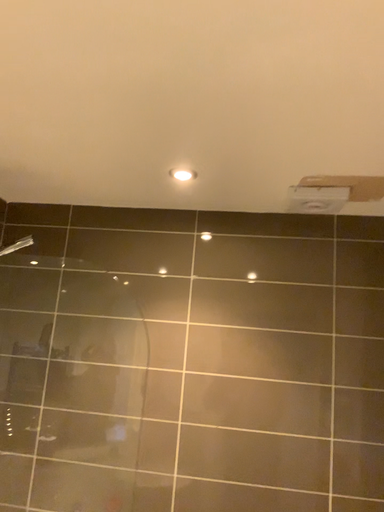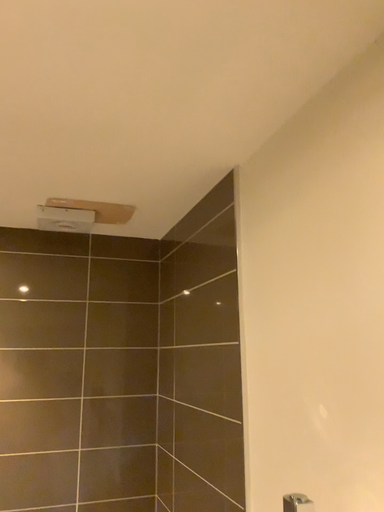
Question: Which way did the camera rotate in the video?

Choices:
 (A) rotated left
 (B) rotated right

Answer: (B)